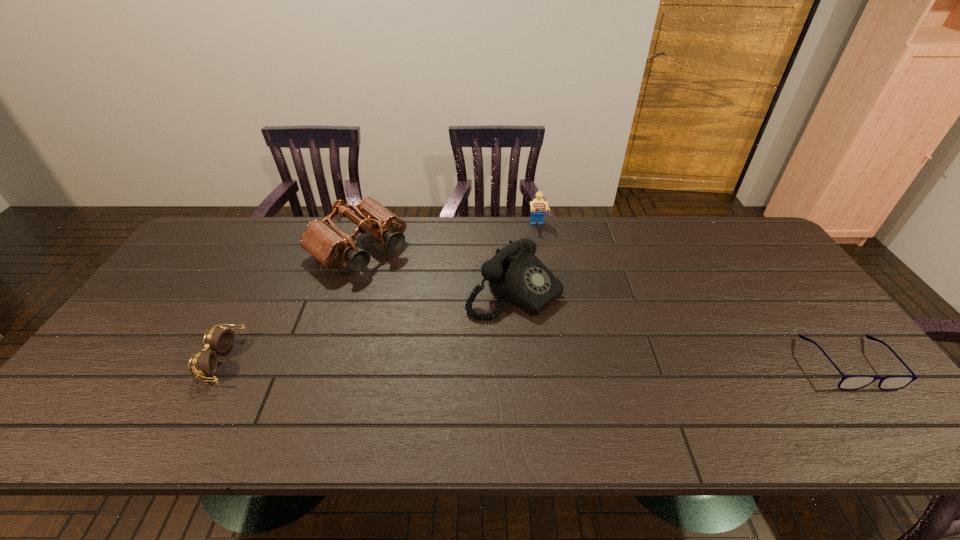
Identify the location of free region located on the dial of the telephone. Image resolution: width=960 pixels, height=540 pixels. (683, 397).

Where is `blank space located on the dial of the telephone`? This screenshot has width=960, height=540. blank space located on the dial of the telephone is located at coordinates (683, 397).

At what (x,y) coordinates should I click in order to perform the action: click on vacant space located 0.370m on the dial of the telephone. Please return your answer as a coordinate pair (x, y). This screenshot has width=960, height=540. Looking at the image, I should click on [678, 394].

In order to click on free space located through the eyepieces of the fourth object from right to left in this screenshot , I will do [448, 321].

Where is `blank space located 0.160m through the eyepieces of the fourth object from right to left`? The image size is (960, 540). blank space located 0.160m through the eyepieces of the fourth object from right to left is located at coordinates (420, 299).

At what (x,y) coordinates should I click in order to perform the action: click on vacant space situated through the eyepieces of the fourth object from right to left. Please return your answer as a coordinate pair (x, y). This screenshot has width=960, height=540. Looking at the image, I should click on (429, 306).

Where is `free location located on the face of the Lego`? free location located on the face of the Lego is located at coordinates (549, 288).

Image resolution: width=960 pixels, height=540 pixels. What are the coordinates of `free space located on the face of the Lego` in the screenshot? It's located at (551, 297).

At what (x,y) coordinates should I click in order to perform the action: click on free location located 0.400m on the face of the Lego. Please return your answer as a coordinate pair (x, y). Image resolution: width=960 pixels, height=540 pixels. Looking at the image, I should click on (556, 318).

You are a GUI agent. You are given a task and a screenshot of the screen. Output one action in this format:
    pyautogui.click(x=<x>, y=<y>)
    Task: Click on the binoculars that is at the far edge
    The height and width of the screenshot is (540, 960).
    Given the screenshot: What is the action you would take?
    pyautogui.click(x=322, y=239)